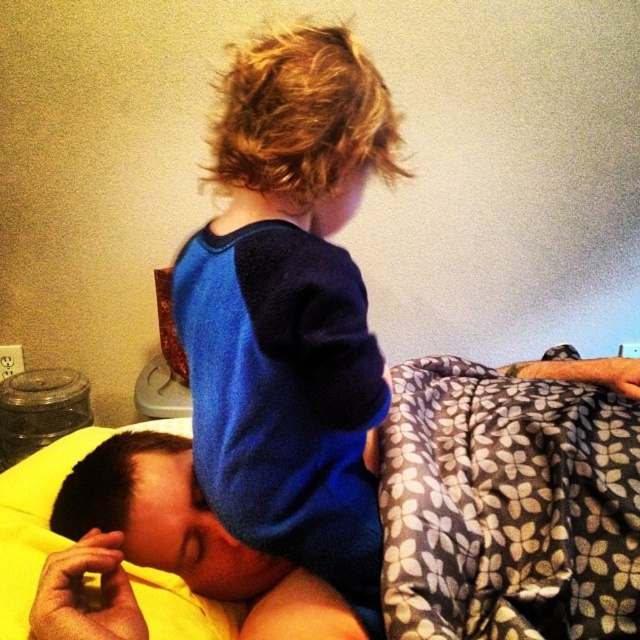
You are standing in the bedroom and want to place a small nightlight between the two points, point [540,524] and point [461,520]. Which point should the nightlight be closer to to ensure it is in front of both points?

The nightlight should be placed closer to point [540,524] because it is in front of point [461,520].